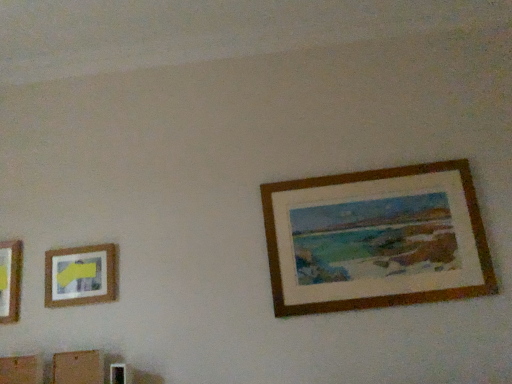
Question: Considering the positions of wooden picture frame at upper right, acting as the 1th picture frame starting from the right, and matte wooden picture frame at left, arranged as the first picture frame when viewed from the left, in the image, is wooden picture frame at upper right, acting as the 1th picture frame starting from the right, wider or thinner than matte wooden picture frame at left, arranged as the first picture frame when viewed from the left,?

Choices:
 (A) thin
 (B) wide

Answer: (B)

Question: Is wooden picture frame at upper right, which ranks as the second picture frame in left-to-right order, bigger or smaller than matte wooden picture frame at left, arranged as the first picture frame when viewed from the left?

Choices:
 (A) big
 (B) small

Answer: (A)

Question: In the image, is wooden picture frame at upper right, which ranks as the second picture frame in left-to-right order, positioned in front of or behind matte wooden picture frame at left, arranged as the first picture frame when viewed from the left?

Choices:
 (A) behind
 (B) front

Answer: (B)

Question: Considering the relative positions of matte wooden picture frame at left, marked as the 2th picture frame in a right-to-left arrangement, and wooden picture frame at upper right, which ranks as the second picture frame in left-to-right order, in the image provided, is matte wooden picture frame at left, marked as the 2th picture frame in a right-to-left arrangement, to the left or to the right of wooden picture frame at upper right, which ranks as the second picture frame in left-to-right order,?

Choices:
 (A) left
 (B) right

Answer: (A)

Question: From the image's perspective, is matte wooden picture frame at left, marked as the 2th picture frame in a right-to-left arrangement, positioned above or below wooden picture frame at upper right, which ranks as the second picture frame in left-to-right order?

Choices:
 (A) below
 (B) above

Answer: (A)

Question: In terms of size, does matte wooden picture frame at left, marked as the 2th picture frame in a right-to-left arrangement, appear bigger or smaller than wooden picture frame at upper right, which ranks as the second picture frame in left-to-right order?

Choices:
 (A) big
 (B) small

Answer: (B)

Question: Is matte wooden picture frame at left, arranged as the first picture frame when viewed from the left, taller or shorter than wooden picture frame at upper right, acting as the 1th picture frame starting from the right?

Choices:
 (A) tall
 (B) short

Answer: (B)